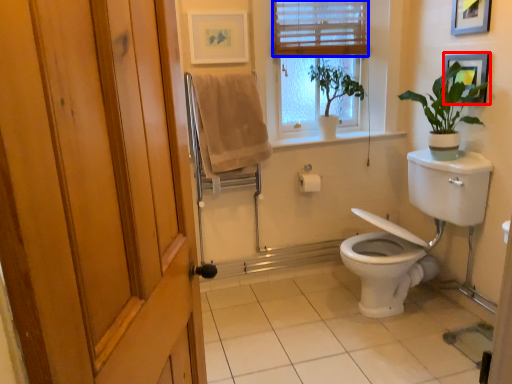
Question: Which of the following is the closest to the observer, picture frame (highlighted by a red box) or blind (highlighted by a blue box)?

Choices:
 (A) picture frame
 (B) blind

Answer: (A)